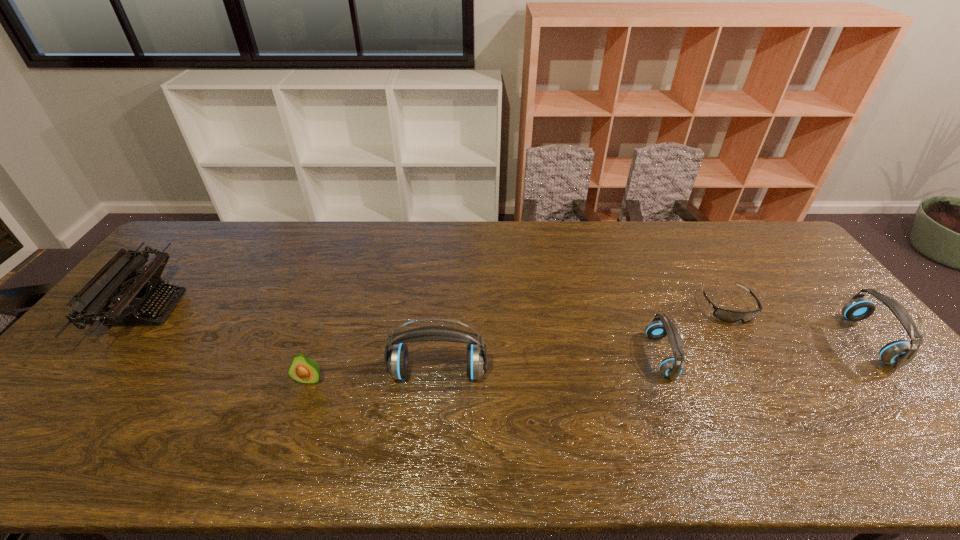
This screenshot has height=540, width=960. Identify the location of vacant space located 0.080m on the ear cups of the tallest headset. [434, 416].

Find the location of a particular element. This screenshot has height=540, width=960. vacant space situated 0.340m on the ear cups of the shortest headset is located at coordinates (801, 356).

Locate an element on the screen. The height and width of the screenshot is (540, 960). vacant space situated on the ear cups of the rightmost object is located at coordinates (746, 340).

Identify the location of free space located on the ear cups of the rightmost object. This screenshot has width=960, height=540. (786, 340).

The height and width of the screenshot is (540, 960). Find the location of `free space located on the ear cups of the rightmost object`. free space located on the ear cups of the rightmost object is located at coordinates (735, 340).

What are the coordinates of `free point located on the lenses of the goggles` in the screenshot? It's located at (766, 372).

Identify the location of vacant space located 0.260m on the typing side of the typewriter. (264, 309).

The width and height of the screenshot is (960, 540). In order to click on object located at the left edge in this screenshot , I will do `click(115, 283)`.

Where is `object located in the right edge section of the desktop`? Image resolution: width=960 pixels, height=540 pixels. object located in the right edge section of the desktop is located at coordinates (899, 353).

In the image, there is a desktop. Identify the location of free space at the far edge. (507, 249).